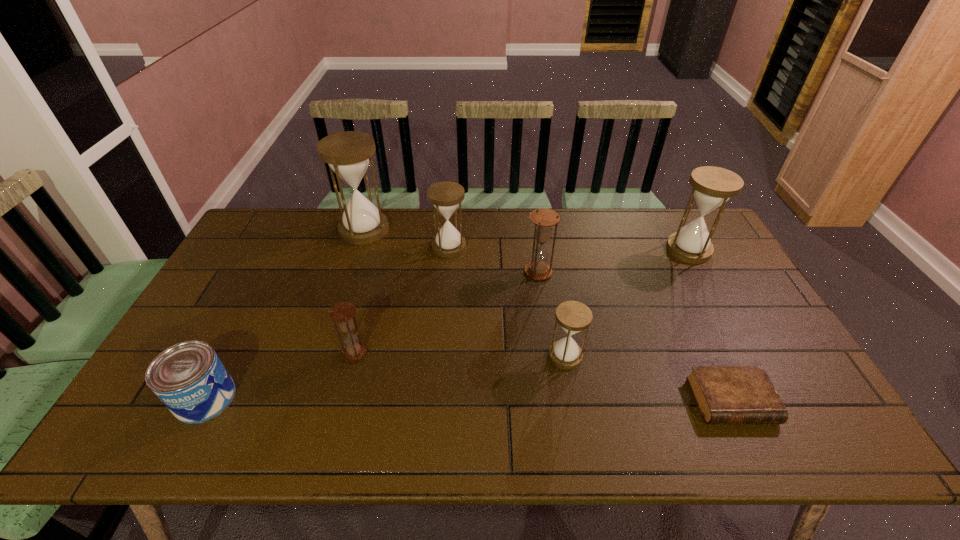
Locate an element on the screen. the left brown hourglass is located at coordinates [342, 313].

You are a GUI agent. You are given a task and a screenshot of the screen. Output one action in this format:
    pyautogui.click(x=<x>, y=<y>)
    Task: Click on the smaller brown hourglass
    Image resolution: width=960 pixels, height=540 pixels.
    Given the screenshot: What is the action you would take?
    pyautogui.click(x=342, y=313)

Where is `the second shortest object`? the second shortest object is located at coordinates (189, 378).

Locate an element on the screen. This screenshot has height=540, width=960. the leftmost object is located at coordinates (189, 378).

The height and width of the screenshot is (540, 960). Identify the location of the shortest object. (724, 394).

The width and height of the screenshot is (960, 540). What are the coordinates of `free location located on the front of the biggest white hourglass` in the screenshot? It's located at (343, 295).

Find the location of a particular element. blank space located 0.230m on the left of the rightmost white hourglass is located at coordinates (598, 249).

Identify the location of free space located on the left of the farther brown hourglass. The width and height of the screenshot is (960, 540). (445, 272).

Where is `vacant space located on the front of the fourth object from left to right`? The width and height of the screenshot is (960, 540). vacant space located on the front of the fourth object from left to right is located at coordinates (440, 357).

At what (x,y) coordinates should I click in order to perform the action: click on free space located on the right of the third white hourglass from left to right. Please return your answer as a coordinate pair (x, y). Looking at the image, I should click on (724, 356).